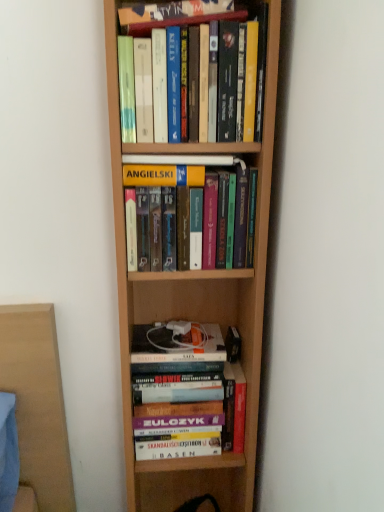
Question: Is wooden bookshelf at lower center positioned far away from hardcover book at upper center, which is the fourth book in bottom-to-top order?

Choices:
 (A) yes
 (B) no

Answer: (A)

Question: Is wooden bookshelf at lower center facing away from hardcover book at upper center, which is the fourth book in bottom-to-top order?

Choices:
 (A) yes
 (B) no

Answer: (B)

Question: Is wooden bookshelf at lower center with hardcover book at upper center, which is the fourth book in bottom-to-top order?

Choices:
 (A) no
 (B) yes

Answer: (A)

Question: Can you confirm if wooden bookshelf at lower center is thinner than hardcover book at upper center, which is the fourth book in bottom-to-top order?

Choices:
 (A) no
 (B) yes

Answer: (A)

Question: Can you confirm if wooden bookshelf at lower center is wider than hardcover book at upper center, positioned as the first book in top-to-bottom order?

Choices:
 (A) no
 (B) yes

Answer: (B)

Question: From a real-world perspective, is wooden bookshelf at lower center positioned under hardcover book at upper center, positioned as the first book in top-to-bottom order, based on gravity?

Choices:
 (A) no
 (B) yes

Answer: (B)

Question: Is hardcover books at center, which is the third book from top to bottom, inside hardcover books at upper center, the 2th book viewed from the top?

Choices:
 (A) no
 (B) yes

Answer: (A)

Question: From the image's perspective, would you say hardcover books at upper center, the third book positioned from the bottom, is shown under hardcover books at center, which is the third book from top to bottom?

Choices:
 (A) no
 (B) yes

Answer: (A)

Question: Does hardcover books at upper center, the third book positioned from the bottom, have a greater width compared to hardcover books at center, marked as the second book in a bottom-to-top arrangement?

Choices:
 (A) no
 (B) yes

Answer: (A)

Question: Can you confirm if hardcover books at upper center, the 2th book viewed from the top, is shorter than hardcover books at center, which is the third book from top to bottom?

Choices:
 (A) yes
 (B) no

Answer: (B)

Question: Does hardcover books at upper center, the third book positioned from the bottom, have a smaller size compared to hardcover books at center, marked as the second book in a bottom-to-top arrangement?

Choices:
 (A) no
 (B) yes

Answer: (A)

Question: From a real-world perspective, is hardcover books at upper center, the 2th book viewed from the top, positioned over hardcover books at center, marked as the second book in a bottom-to-top arrangement, based on gravity?

Choices:
 (A) yes
 (B) no

Answer: (A)

Question: Is hardcover books at center, which is the third book from top to bottom, inside wooden bookshelf at lower center?

Choices:
 (A) no
 (B) yes

Answer: (A)